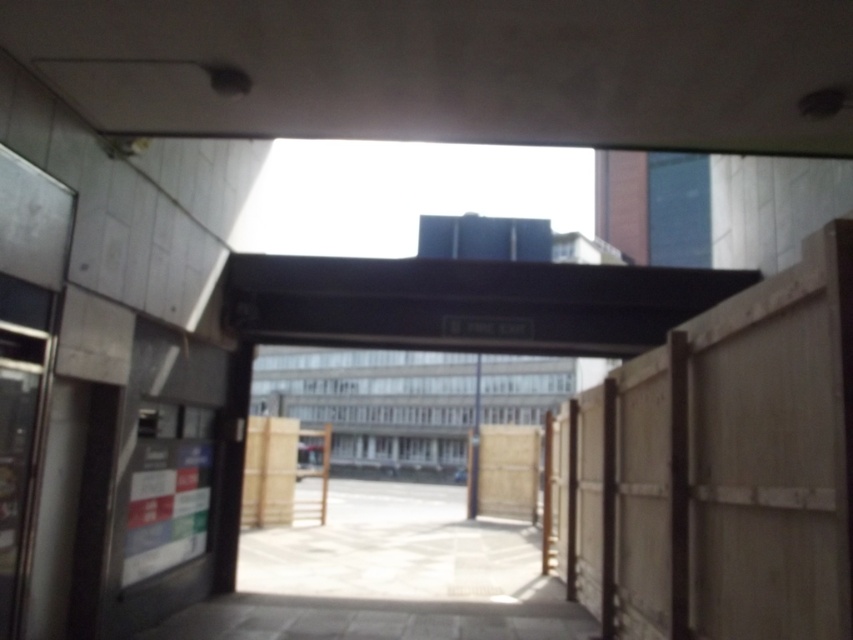
Question: Is the position of black matte overpass at center less distant than that of gray concrete parking garage at center?

Choices:
 (A) no
 (B) yes

Answer: (B)

Question: Can you confirm if black matte overpass at center is thinner than gray concrete parking garage at center?

Choices:
 (A) no
 (B) yes

Answer: (B)

Question: Among these objects, which one is nearest to the camera?

Choices:
 (A) gray concrete parking garage at center
 (B) black matte overpass at center

Answer: (B)

Question: Is black matte overpass at center below gray concrete parking garage at center?

Choices:
 (A) yes
 (B) no

Answer: (B)

Question: Which object is farther from the camera taking this photo?

Choices:
 (A) black matte overpass at center
 (B) gray concrete parking garage at center

Answer: (B)

Question: Which object is closer to the camera taking this photo?

Choices:
 (A) gray concrete parking garage at center
 (B) black matte overpass at center

Answer: (B)